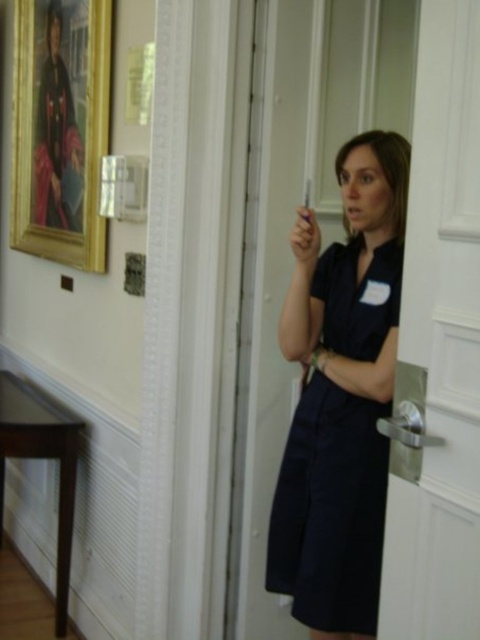
You are a visitor in the museum and want to exit through the door. You see the white glossy door at center and the matte plastic cigarette at center. Which object is closer to the floor?

The white glossy door at center is positioned under the matte plastic cigarette at center, so the white glossy door at center is closer to the floor.

You are an interior designer assessing the proportions of items in the room. The navy blue fabric dress at center and the matte black portrait at upper left are both in your view. Which object appears larger in size?

The matte black portrait at upper left appears larger in size compared to the navy blue fabric dress at center.

You are a delivery person who needs to place a 12 inch long package between the white glossy door at center and the matte plastic cigarette at center. Can the package fit in the space between them?

The distance between the white glossy door at center and the matte plastic cigarette at center is 24.82 inches. Since the package is 12 inches long, it can fit in the space between them as the distance is more than double the package length.